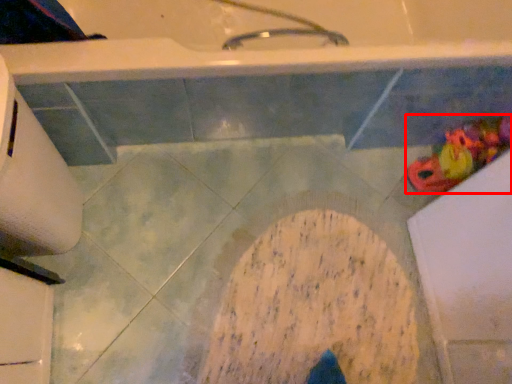
Question: From the image's perspective, where is toy (annotated by the red box) located in relation to toilet paper in the image?

Choices:
 (A) above
 (B) below

Answer: (A)